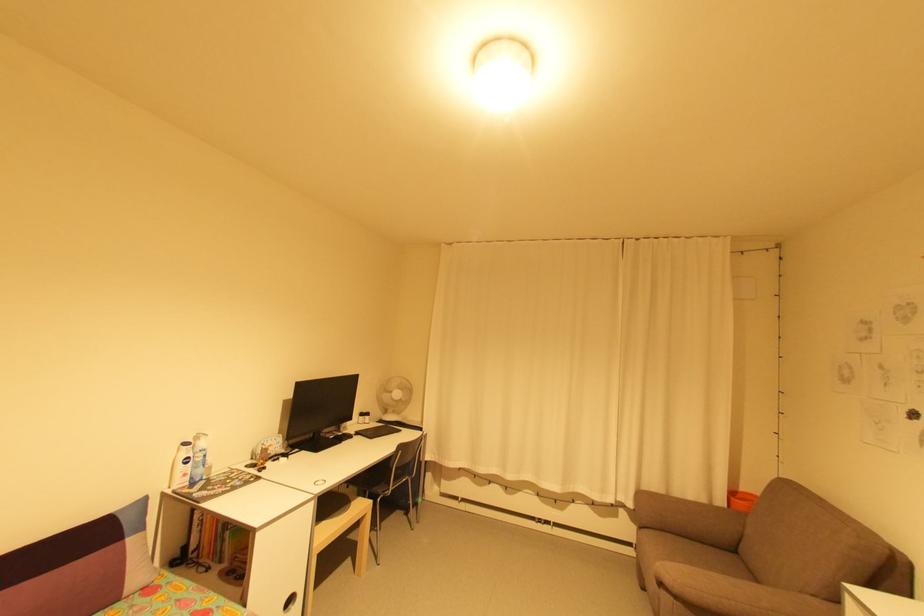
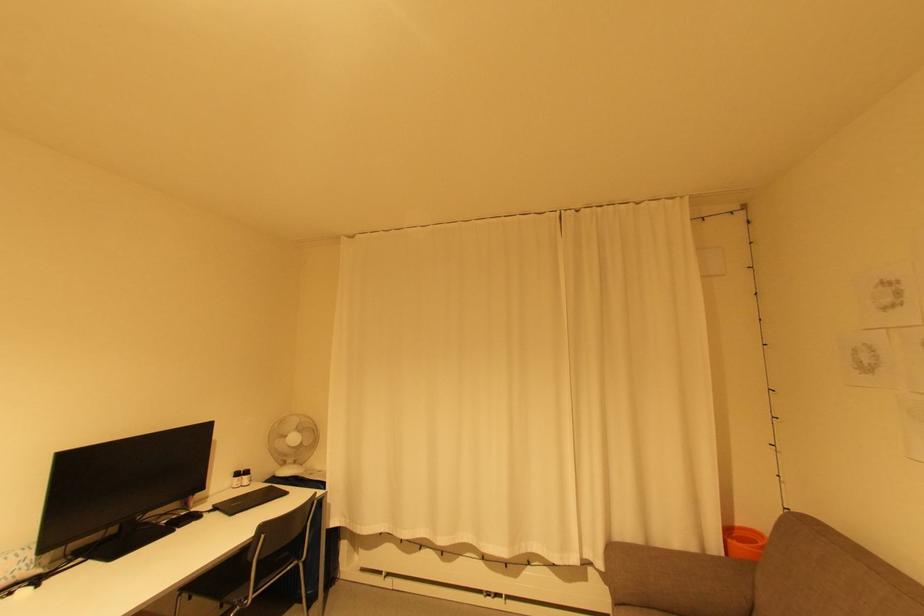
In the second image, find the point that corresponds to (x=736, y=493) in the first image.

(733, 533)